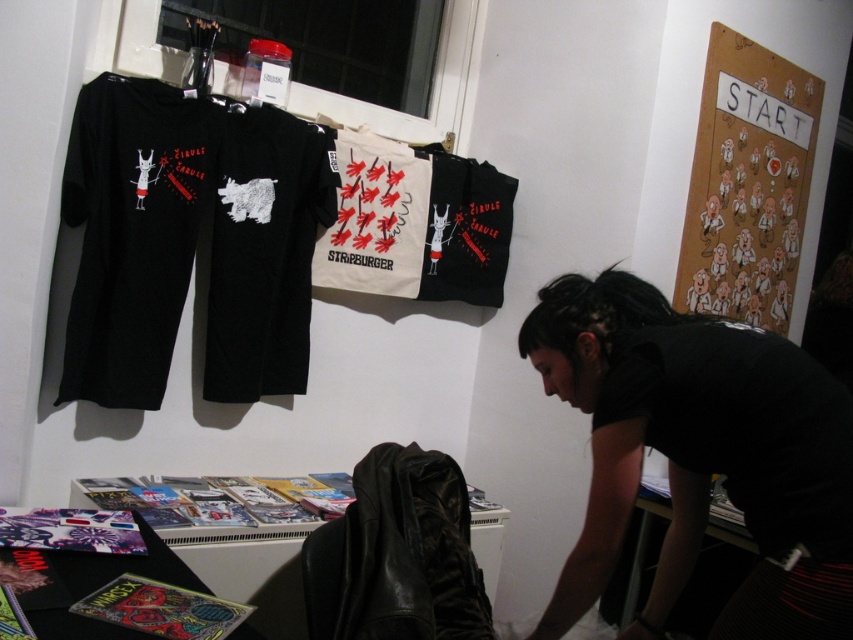
Does black matte shirt at lower right appear on the left side of black matte t-shirt at center?

Incorrect, black matte shirt at lower right is not on the left side of black matte t-shirt at center.

Does black matte shirt at lower right have a greater width compared to black matte t-shirt at center?

Indeed, black matte shirt at lower right has a greater width compared to black matte t-shirt at center.

Where is `black matte shirt at lower right`? Image resolution: width=853 pixels, height=640 pixels. black matte shirt at lower right is located at coordinates (699, 454).

At what (x,y) coordinates should I click in order to perform the action: click on black matte shirt at lower right. Please return your answer as a coordinate pair (x, y). Looking at the image, I should click on (699, 454).